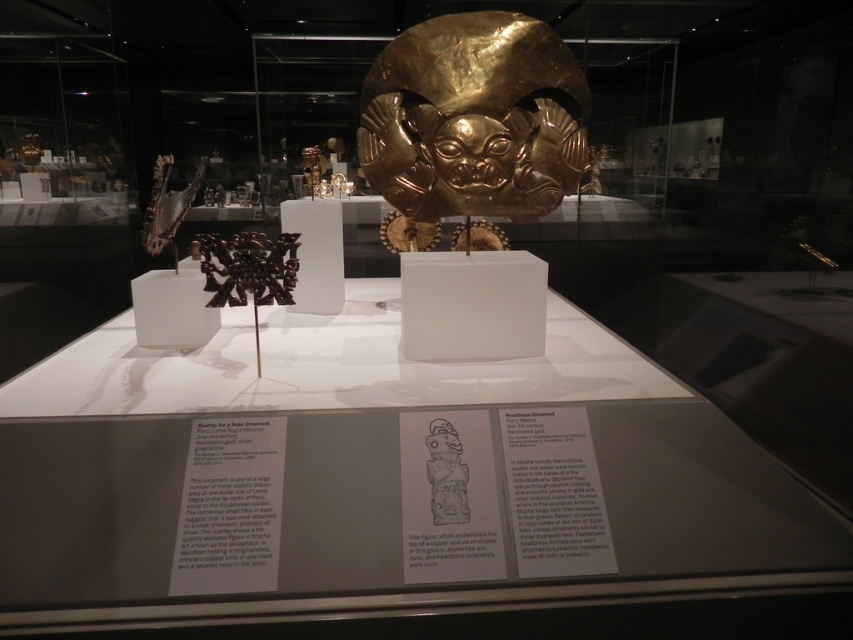
You are a visitor standing in front of the display case. You notice two points marked in the scene. Which point is closer to you, point (483, 172) or point (445, 444)?

Point (445, 444) is closer to you because it is less further to the camera than point (483, 172) according to the description.

You are a museum curator planning to install a protective glass cover over both the gold shiny mask at center and the matte gold mask at center. Given that the glass must be wide enough to cover both, which mask requires the glass to be wider to accommodate its size?

The gold shiny mask at center requires the glass to be wider because its width surpasses that of the matte gold mask at center.